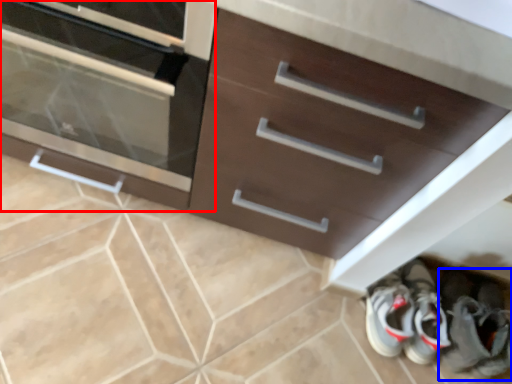
Question: Which point is further to the camera, chest of drawers (highlighted by a red box) or footwear (highlighted by a blue box)?

Choices:
 (A) chest of drawers
 (B) footwear

Answer: (B)